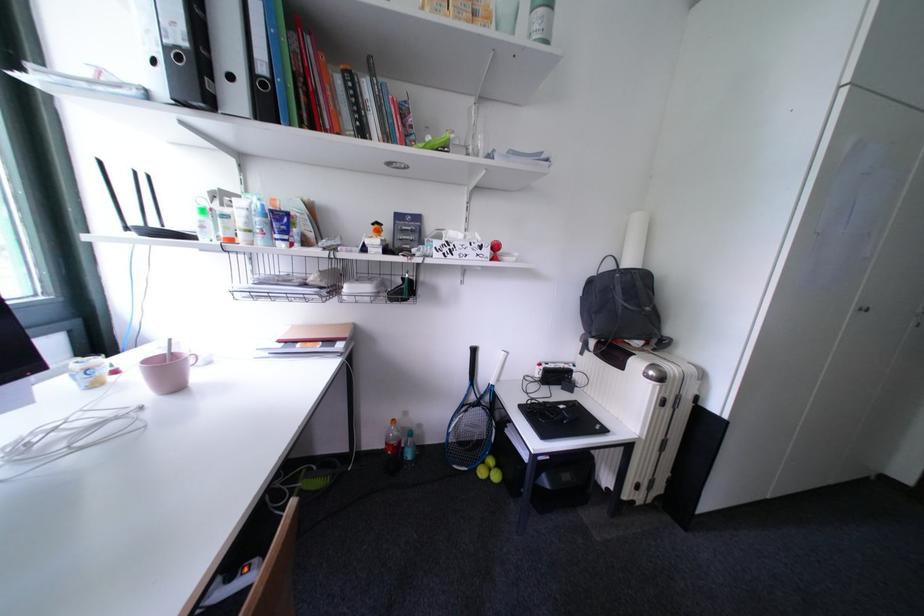
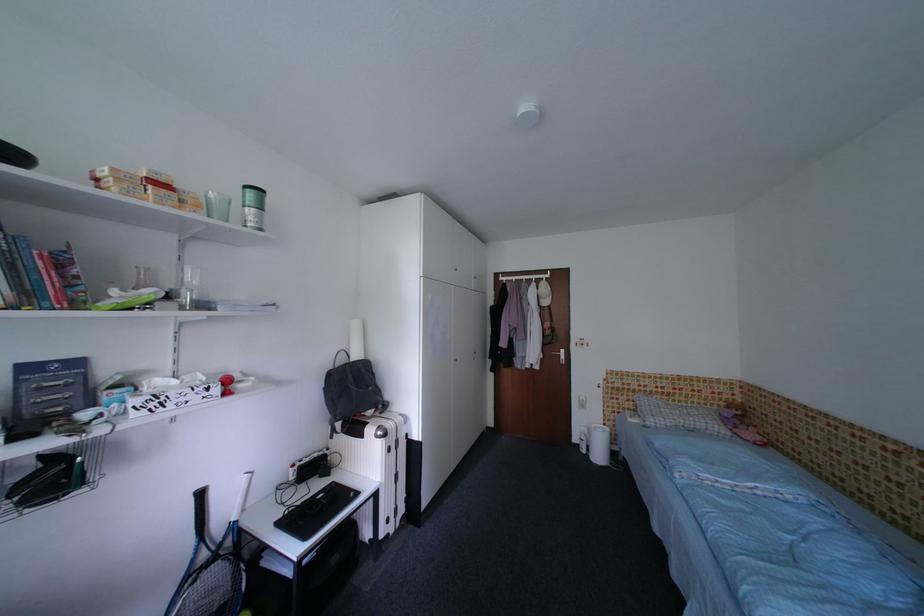
Question: The camera is either moving clockwise (left) or counter-clockwise (right) around the object. The first image is from the beginning of the video and the second image is from the end. Is the camera moving left or right when shooting the video?

Choices:
 (A) Left
 (B) Right

Answer: (A)